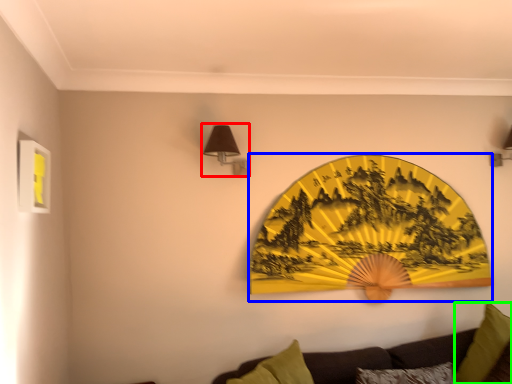
Question: Which is farther away from lamp (highlighted by a red box)? design (highlighted by a blue box) or pillow (highlighted by a green box)?

Choices:
 (A) design
 (B) pillow

Answer: (B)